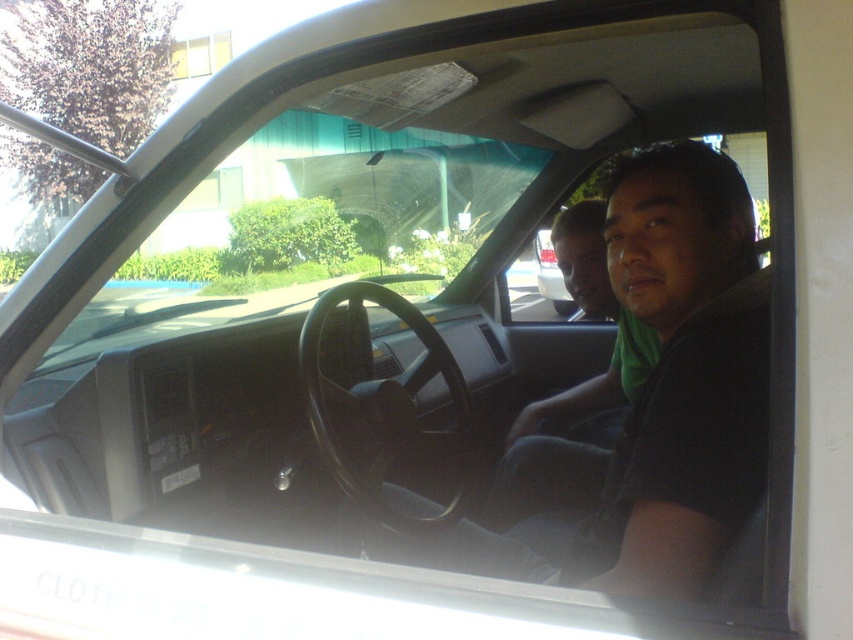
You are trying to determine which of the two shirts in the car is wider. You see the black matte shirt at center and the matte black shirt at center. Which one has a greater width?

The black matte shirt at center has a greater width than the matte black shirt at center according to the description.

Looking at this image, you are a delivery person trying to hand a package to the driver wearing the black matte shirt at center and the passenger wearing the matte black shirt at center. Can you reach both individuals through the open window without moving your position?

The black matte shirt at center and the matte black shirt at center are 3.30 feet apart from each other. Since the distance between them is more than 3 feet, you might struggle to reach both comfortably from your current position without moving.

You are standing outside the car and looking through the open driver side window. You see the black matte shirt at center and the matte black shirt at center inside the car. Which one is closer to the bottom of the car window?

The black matte shirt at center is located below the matte black shirt at center, so the black matte shirt at center is closer to the bottom of the car window.